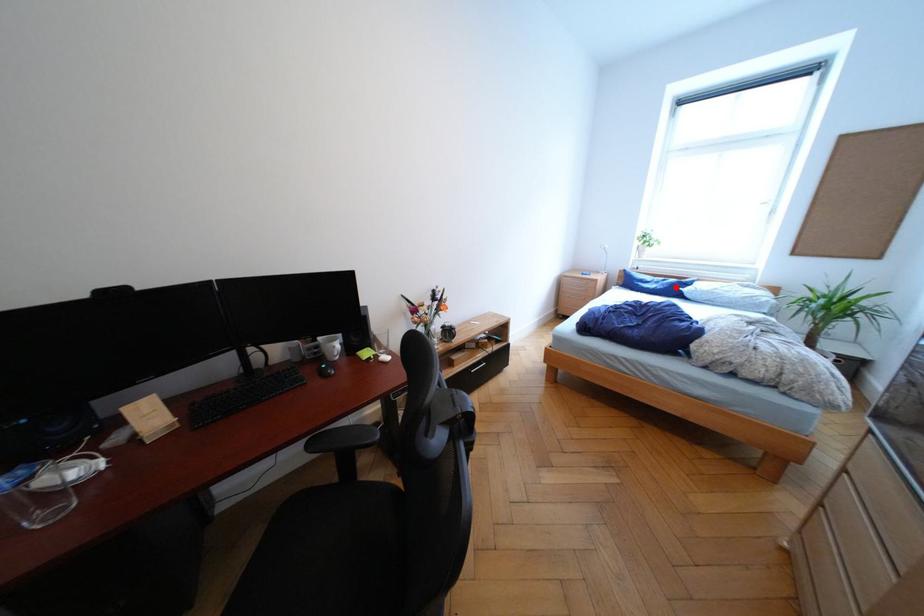
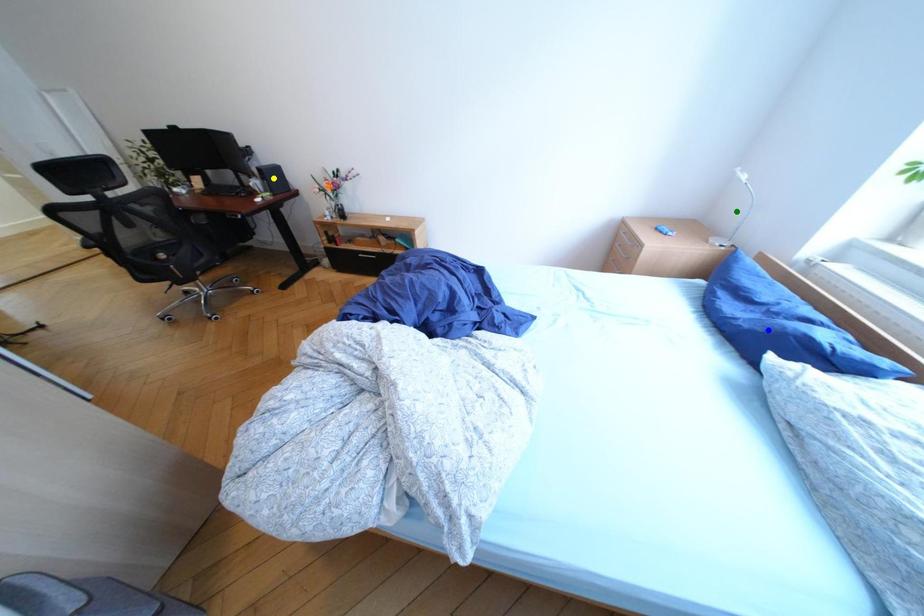
Question: I am providing you with two images of the same scene from different viewpoints. A red point is marked on the first image. You are given multiple points on the second image. Which spot in image 2 lines up with the point in image 1?

Choices:
 (A) green point
 (B) yellow point
 (C) blue point

Answer: (C)